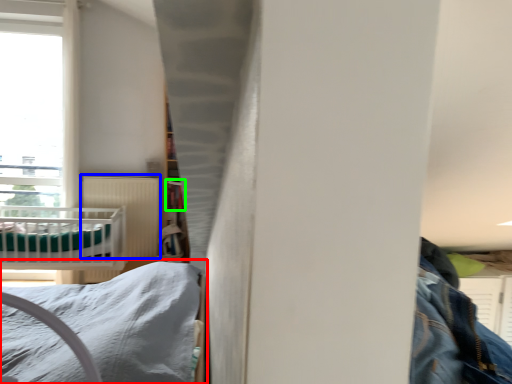
Question: Estimate the real-world distances between objects in this image. Which object is farther from bed (highlighted by a red box), radiator (highlighted by a blue box) or shelf (highlighted by a green box)?

Choices:
 (A) radiator
 (B) shelf

Answer: (A)